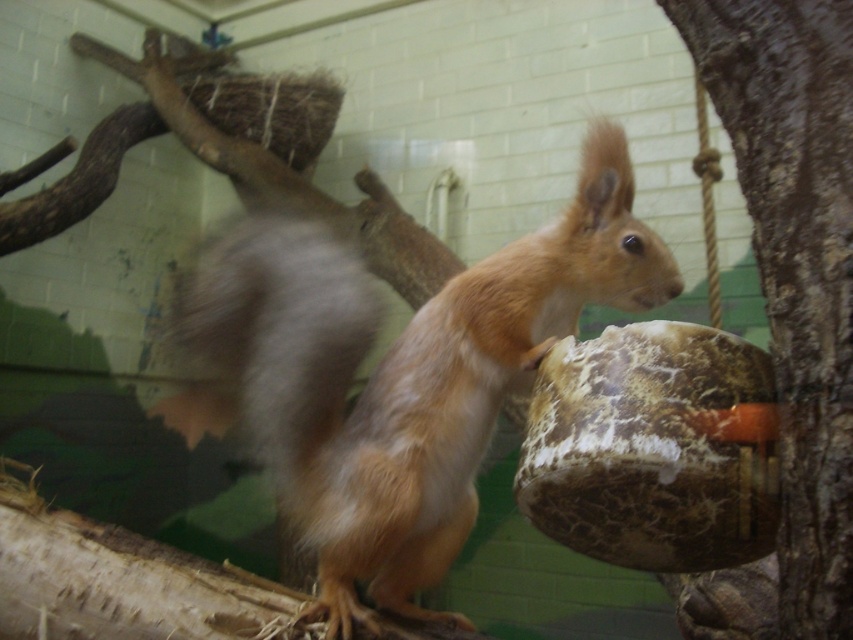
Question: Which point is closer to the camera?

Choices:
 (A) fluffy brown squirrel at center
 (B) brown rough bark at right

Answer: (B)

Question: Is fluffy brown squirrel at center thinner than brown rough bark at right?

Choices:
 (A) yes
 (B) no

Answer: (B)

Question: Is the position of fluffy brown squirrel at center less distant than that of brown rough bark at right?

Choices:
 (A) no
 (B) yes

Answer: (A)

Question: Does fluffy brown squirrel at center appear on the left side of brown rough bark at right?

Choices:
 (A) yes
 (B) no

Answer: (A)